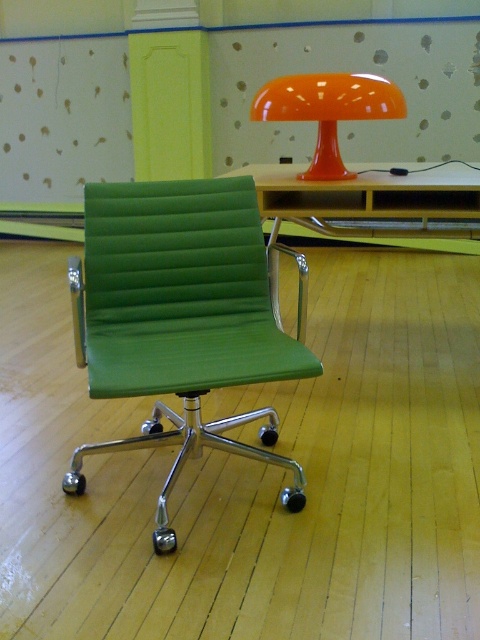
Question: Which of the following is the closest to the observer?

Choices:
 (A) light wood table at center
 (B) green leather chair at center

Answer: (B)

Question: Can you confirm if green leather chair at center is positioned to the left of light wood table at center?

Choices:
 (A) yes
 (B) no

Answer: (A)

Question: Does green leather chair at center appear on the right side of light wood table at center?

Choices:
 (A) no
 (B) yes

Answer: (A)

Question: Is green leather chair at center closer to camera compared to light wood table at center?

Choices:
 (A) no
 (B) yes

Answer: (B)

Question: Which of the following is the farthest from the observer?

Choices:
 (A) (303, 202)
 (B) (159, 330)

Answer: (A)